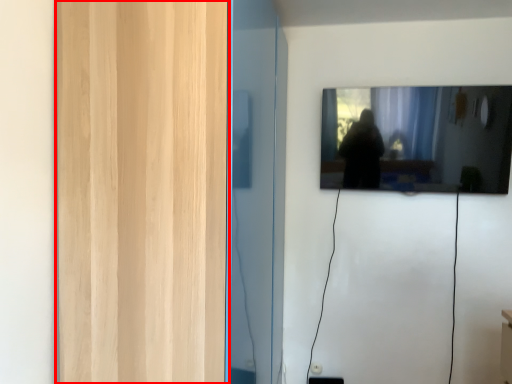
Question: From the image's perspective, where is glass door (annotated by the red box) located in relation to mirror in the image?

Choices:
 (A) above
 (B) below

Answer: (B)